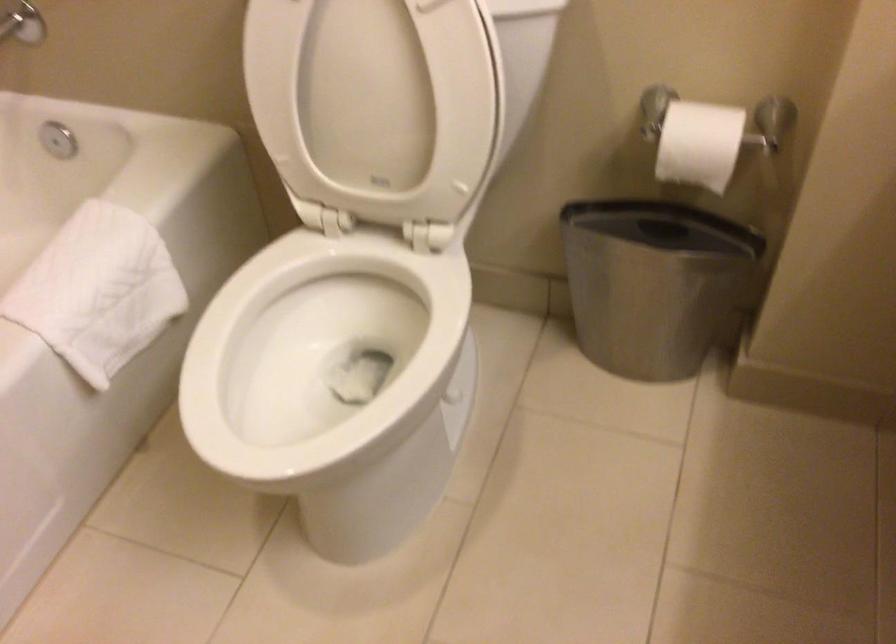
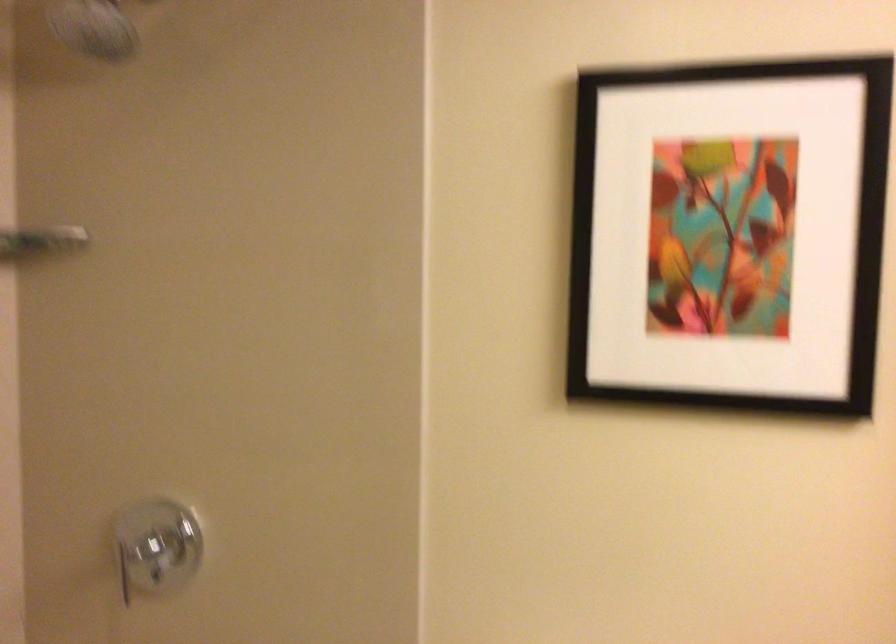
Question: Based on the continuous images, in which direction is the camera rotating? Reply with the corresponding letter.

Choices:
 (A) Left
 (B) Right
 (C) Up
 (D) Down

Answer: (C)